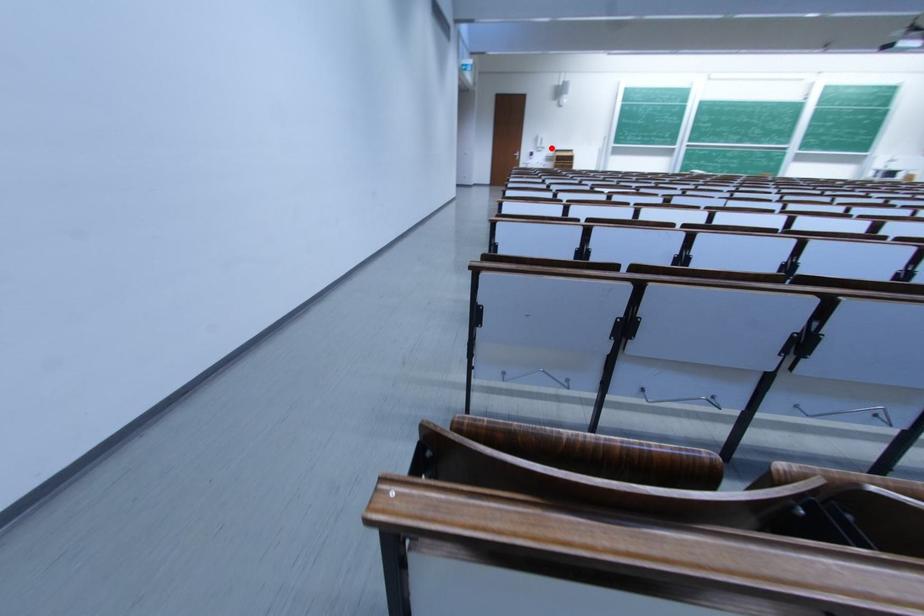
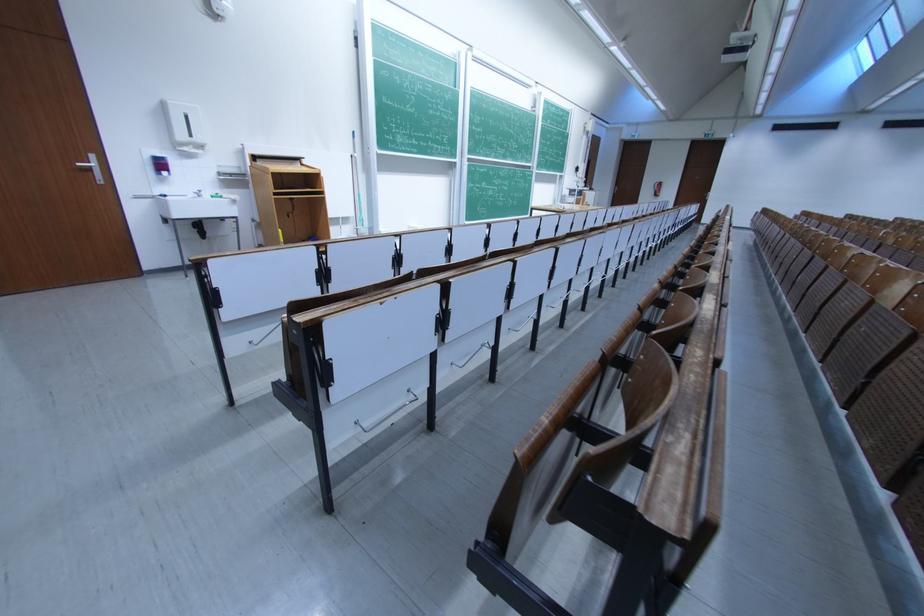
Question: I am providing you with two images of the same scene from different viewpoints. A red point is shown in image1. For the corresponding object point in image2, is it positioned nearer or farther from the camera?

Choices:
 (A) Nearer
 (B) Farther

Answer: (B)